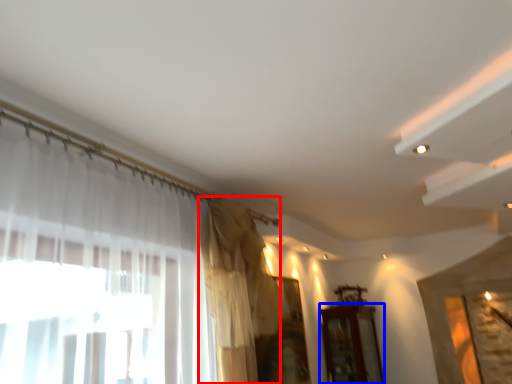
Question: Which object appears closest to the camera in this image, curtain (highlighted by a red box) or furniture (highlighted by a blue box)?

Choices:
 (A) curtain
 (B) furniture

Answer: (A)